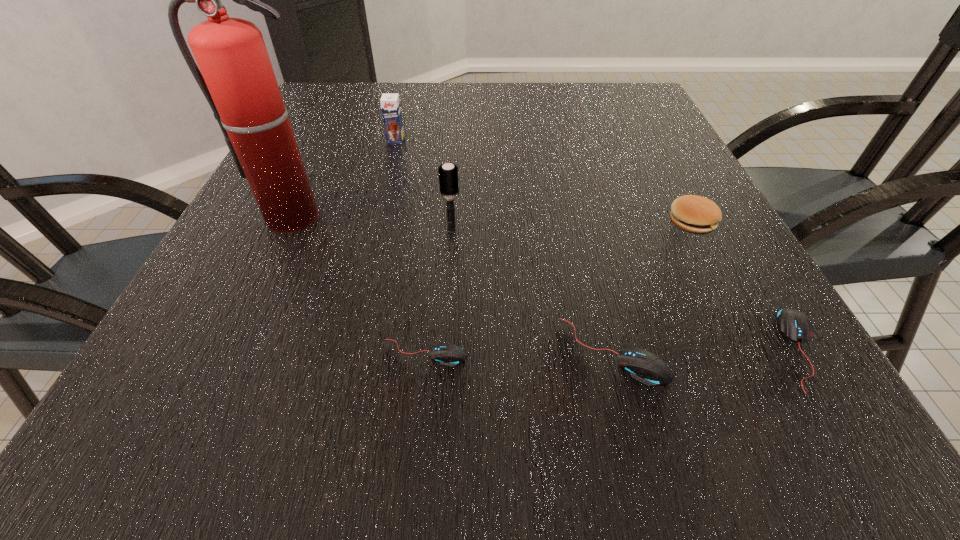
Locate an element on the screen. The image size is (960, 540). patty at the right edge is located at coordinates (694, 214).

Where is `object at the near right corner`? This screenshot has height=540, width=960. object at the near right corner is located at coordinates (794, 325).

This screenshot has height=540, width=960. Identify the location of free region at the far edge of the desktop. (425, 99).

The width and height of the screenshot is (960, 540). In the image, there is a desktop. What are the coordinates of `vacant area at the near edge` in the screenshot? It's located at (282, 356).

In the image, there is a desktop. In order to click on vacant space at the left edge in this screenshot , I will do `click(359, 123)`.

You are a GUI agent. You are given a task and a screenshot of the screen. Output one action in this format:
    pyautogui.click(x=<x>, y=<y>)
    Task: Click on the vacant space at the far left corner
    The width and height of the screenshot is (960, 540).
    Given the screenshot: What is the action you would take?
    pyautogui.click(x=304, y=114)

Find the location of a particular element. vacant area at the near left corner is located at coordinates tap(231, 364).

Where is `blank space at the far right corner of the desktop`? The height and width of the screenshot is (540, 960). blank space at the far right corner of the desktop is located at coordinates [x=624, y=122].

Find the location of a particular element. vacant space that is in between the leftmost mouse and the farthest object is located at coordinates (410, 246).

You are a GUI agent. You are given a task and a screenshot of the screen. Output one action in this format:
    pyautogui.click(x=<x>, y=<y>)
    Task: Click on the vacant space that is in between the patty and the second tallest object
    This screenshot has width=960, height=540.
    Given the screenshot: What is the action you would take?
    pyautogui.click(x=571, y=226)